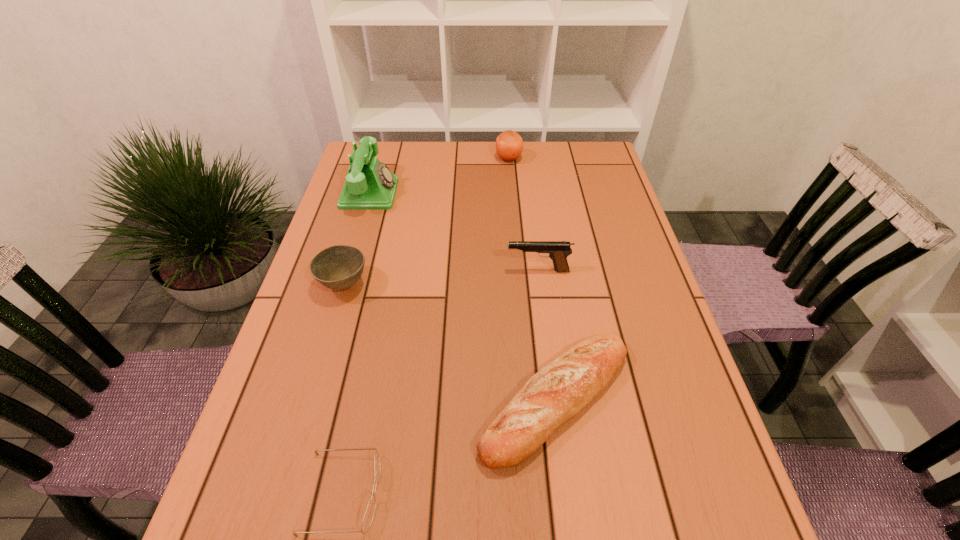
Identify the location of telephone. pyautogui.click(x=370, y=185).

Locate an element on the screen. the fifth nearest object is located at coordinates 370,185.

I want to click on orange, so click(509, 145).

I want to click on pistol, so click(558, 251).

Where is `bowl`? bowl is located at coordinates (339, 267).

I want to click on baguet, so click(558, 392).

Find the location of a particular element. spectacles is located at coordinates [369, 514].

Identify the location of free space located 0.140m on the dial of the second farthest object. (443, 193).

Locate an element on the screen. free space located on the front of the farthest object is located at coordinates (510, 175).

What are the coordinates of `vacant region located 0.180m at the muzzle of the pistol` in the screenshot? It's located at (434, 271).